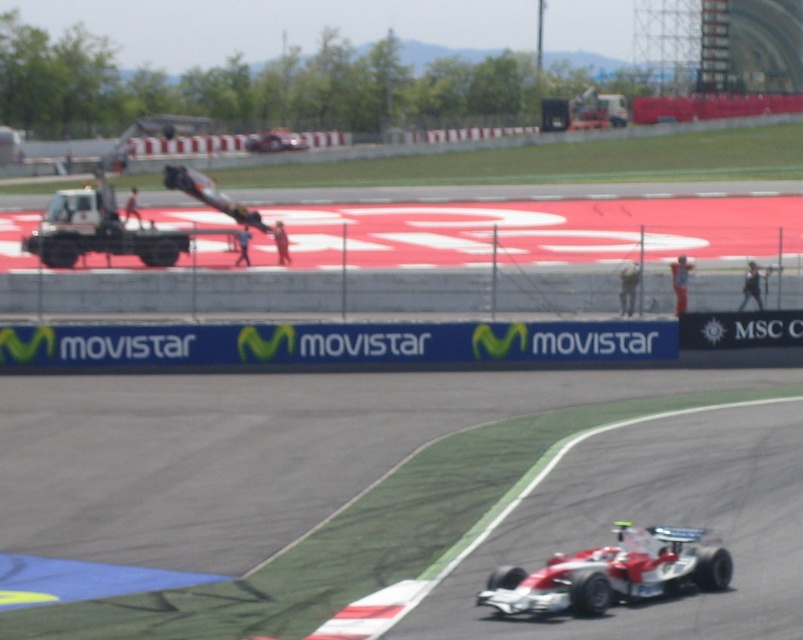
Does white glossy race car at lower right have a lesser height compared to white matte car at center?

Yes, white glossy race car at lower right is shorter than white matte car at center.

Does white glossy race car at lower right have a greater width compared to white matte car at center?

No.

Who is more distant from viewer, (x=581, y=582) or (x=259, y=134)?

The point (x=259, y=134) is behind.

At what (x,y) coordinates should I click in order to perform the action: click on white glossy race car at lower right. Please return your answer as a coordinate pair (x, y). Looking at the image, I should click on (612, 572).

Does white glossy race car at lower right appear under white matte tow truck at left?

Correct, white glossy race car at lower right is located below white matte tow truck at left.

Between white glossy race car at lower right and white matte tow truck at left, which one appears on the right side from the viewer's perspective?

white glossy race car at lower right

Find the location of `white glossy race car at lower right`. white glossy race car at lower right is located at coordinates (612, 572).

At what (x,y) coordinates should I click in order to perform the action: click on white matte tow truck at left. Please return your answer as a coordinate pair (x, y). The width and height of the screenshot is (803, 640). Looking at the image, I should click on (96, 230).

Can you confirm if white matte tow truck at left is positioned above white matte car at center?

Incorrect, white matte tow truck at left is not positioned above white matte car at center.

The width and height of the screenshot is (803, 640). Describe the element at coordinates (96, 230) in the screenshot. I see `white matte tow truck at left` at that location.

Find the location of a particular element. This screenshot has height=640, width=803. white matte tow truck at left is located at coordinates point(96,230).